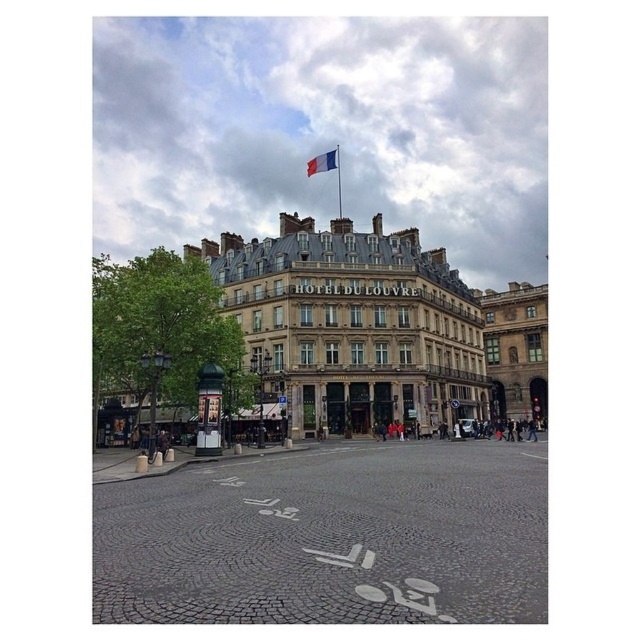
You are a city planner assessing the placement of the tricolor fabric flag at center top and the blue metallic flag pole at upper center. Given that the flag pole is 2.5 meters tall, can the flag be safely lowered to the ground without touching the pole?

The distance between the tricolor fabric flag at center top and the blue metallic flag pole at upper center is 3.80 meters. Since the pole is only 2.5 meters tall, lowering the flag would require at least 2.5 meters of clearance. The 3.80 meters distance ensures there is enough space between them, so the flag can be safely lowered without touching the pole.

You are a tourist standing in front of the Hotel du Louvre. You notice the white cobblestone plaza at center and the tricolor fabric flag at center top. Which object is taller?

The tricolor fabric flag at center top is taller than the white cobblestone plaza at center.

You are an architect visiting the Hotel du Louvre. You notice the brown stone building at center and the blue metallic flag pole at upper center. Which object takes up more space in the scene?

The brown stone building at center is bigger than the blue metallic flag pole at upper center, so it takes up more space in the scene.